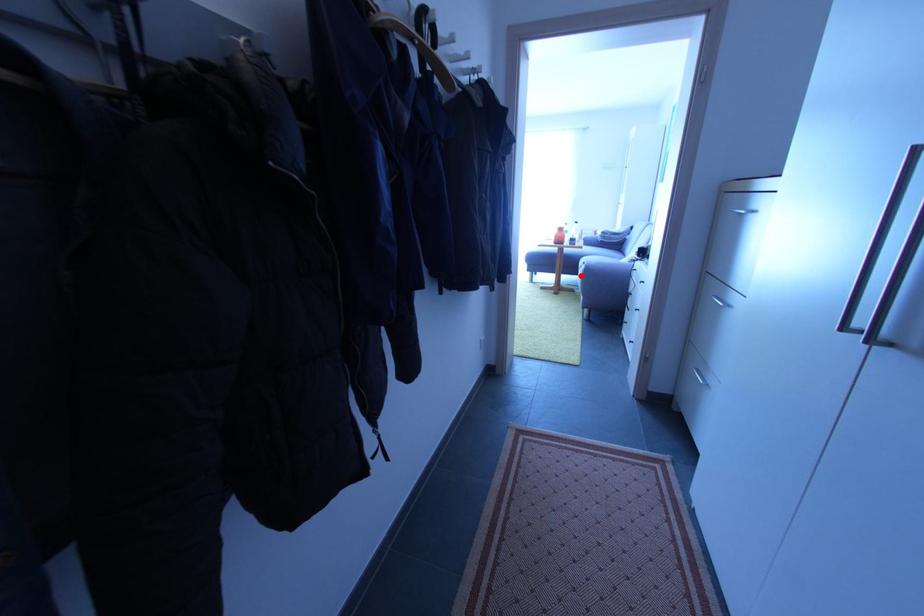
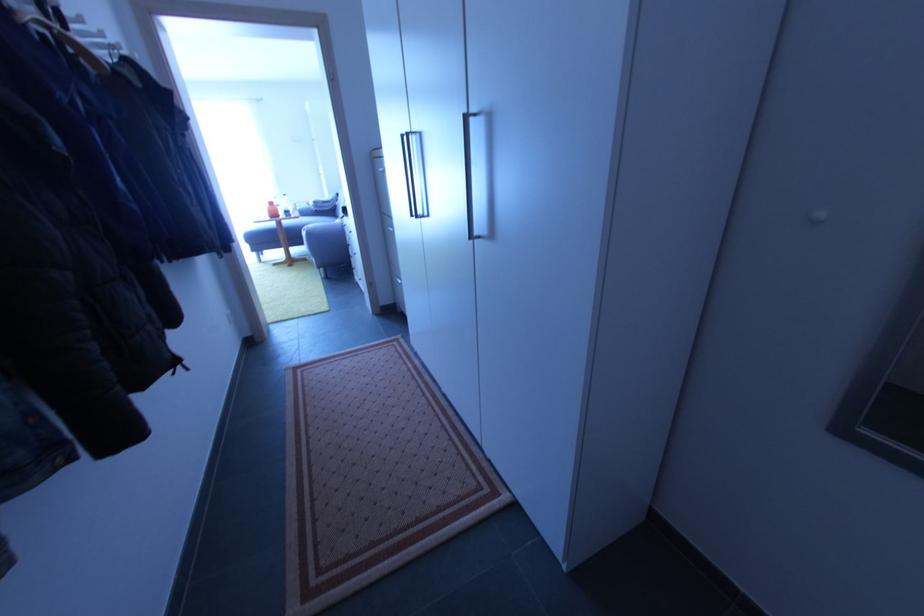
Question: A red point is marked in image1. In image2, is the corresponding 3D point closer to the camera or farther? Reply with the corresponding letter.

Choices:
 (A) The corresponding 3D point is closer.
 (B) The corresponding 3D point is farther.

Answer: (A)